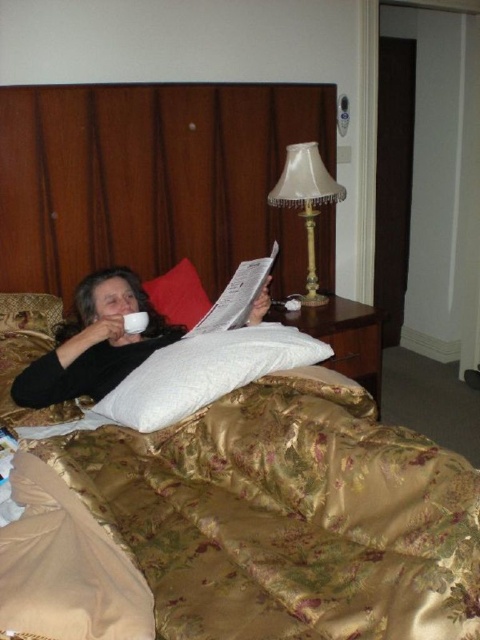
Question: Which point appears farthest from the camera in this image?

Choices:
 (A) (124, 332)
 (B) (168, 310)
 (C) (210, 324)

Answer: (B)

Question: Is white satin lampshade at upper center behind white satin pillow at upper left?

Choices:
 (A) yes
 (B) no

Answer: (A)

Question: Can you confirm if gold satin bed at center is bigger than white satin lampshade at upper center?

Choices:
 (A) no
 (B) yes

Answer: (B)

Question: Among these points, which one is nearest to the camera?

Choices:
 (A) (46, 307)
 (B) (94, 340)
 (C) (167, 401)
 (D) (252, 269)

Answer: (C)

Question: Which point is farther to the camera?

Choices:
 (A) (1, 323)
 (B) (175, 296)
 (C) (108, 385)
 (D) (252, 278)

Answer: (B)

Question: Where is gold satin bed at center located in relation to matte black cup at upper left in the image?

Choices:
 (A) left
 (B) right

Answer: (B)